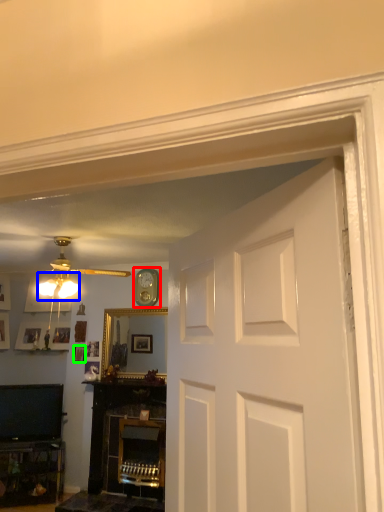
Question: Considering the real-world distances, which object is farthest from clock (highlighted by a red box)? lamp (highlighted by a blue box) or picture frame (highlighted by a green box)?

Choices:
 (A) lamp
 (B) picture frame

Answer: (A)